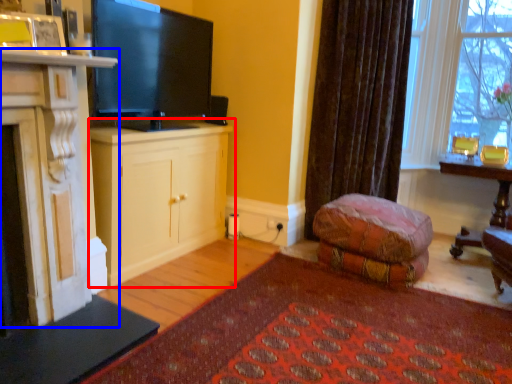
Question: Among these objects, which one is farthest to the camera, cabinetry (highlighted by a red box) or cabinetry (highlighted by a blue box)?

Choices:
 (A) cabinetry
 (B) cabinetry

Answer: (A)